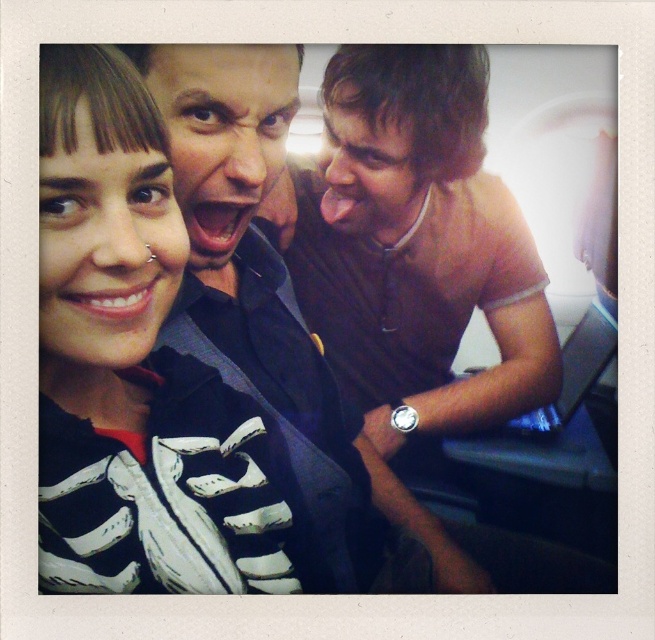
Is matte black skeleton shirt at upper left behind brown fabric shirt at right?

No, it is in front of brown fabric shirt at right.

What do you see at coordinates (134, 365) in the screenshot? Image resolution: width=655 pixels, height=640 pixels. I see `matte black skeleton shirt at upper left` at bounding box center [134, 365].

Who is more forward, (x=153, y=531) or (x=500, y=317)?

Point (x=153, y=531) is more forward.

Locate an element on the screen. The image size is (655, 640). matte black skeleton shirt at upper left is located at coordinates (134, 365).